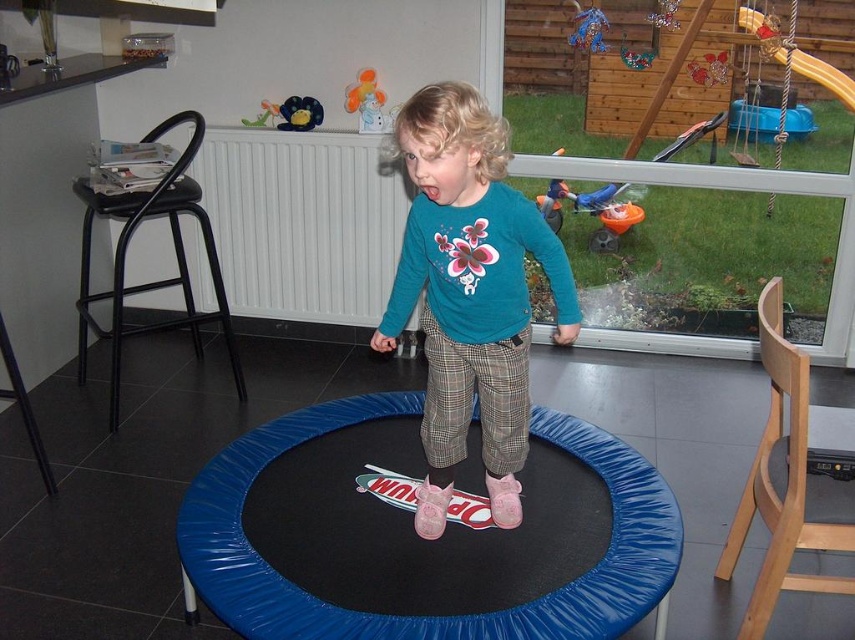
Is point (655, 492) positioned before point (263, 108)?

Yes, point (655, 492) is in front of point (263, 108).

Who is lower down, blue rubber mat at center or green plastic toy at upper center?

Positioned lower is blue rubber mat at center.

Which is behind, point (192, 509) or point (248, 122)?

The point (248, 122) is more distant.

Where is `blue rubber mat at center`? blue rubber mat at center is located at coordinates (431, 618).

Between matte plastic toy at upper center and green plastic toy at upper center, which one is positioned higher?

Positioned higher is matte plastic toy at upper center.

Who is more distant from viewer, (363, 99) or (264, 100)?

Point (264, 100)

The image size is (855, 640). Identify the location of matte plastic toy at upper center. (366, 100).

Who is taller, orange plastic wheelbarrow at center or green plastic toy at upper center?

orange plastic wheelbarrow at center

Between orange plastic wheelbarrow at center and green plastic toy at upper center, which one appears on the right side from the viewer's perspective?

From the viewer's perspective, orange plastic wheelbarrow at center appears more on the right side.

Is point (558, 216) positioned after point (266, 106)?

Yes, point (558, 216) is farther from viewer.

Image resolution: width=855 pixels, height=640 pixels. Identify the location of orange plastic wheelbarrow at center. (593, 211).